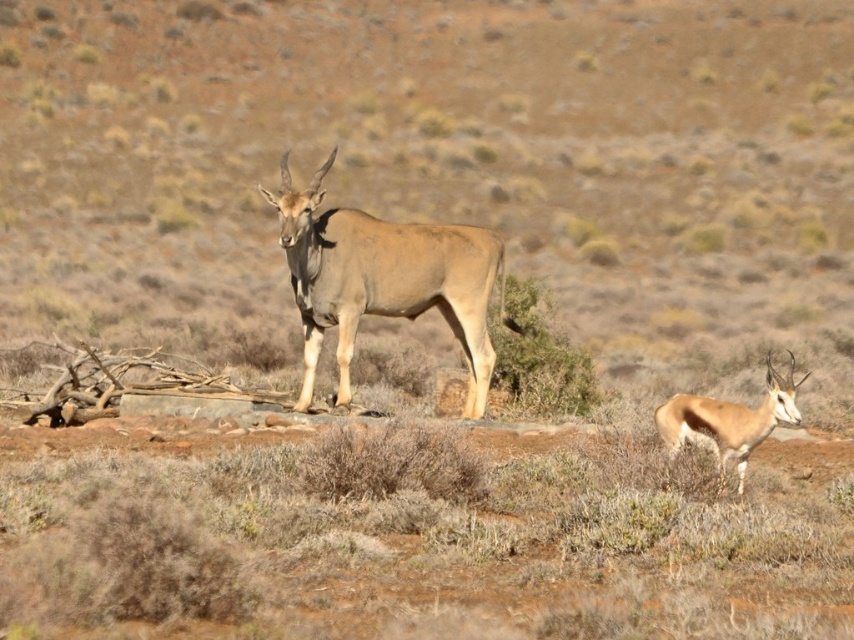
Question: Which object is farther from the camera taking this photo?

Choices:
 (A) light brown fur antelope at center
 (B) green leafy bush at center

Answer: (B)

Question: Does light brown fur antelope at center appear under green leafy bush at center?

Choices:
 (A) yes
 (B) no

Answer: (B)

Question: Is light brown fur antelope at center positioned in front of smooth brown antelope at lower right?

Choices:
 (A) no
 (B) yes

Answer: (A)

Question: Which point is closer to the camera?

Choices:
 (A) (740, 404)
 (B) (490, 326)

Answer: (A)

Question: Can you confirm if green leafy bush at center is positioned to the left of smooth brown antelope at lower right?

Choices:
 (A) yes
 (B) no

Answer: (A)

Question: Which point is closer to the camera taking this photo?

Choices:
 (A) (686, 397)
 (B) (521, 288)

Answer: (A)